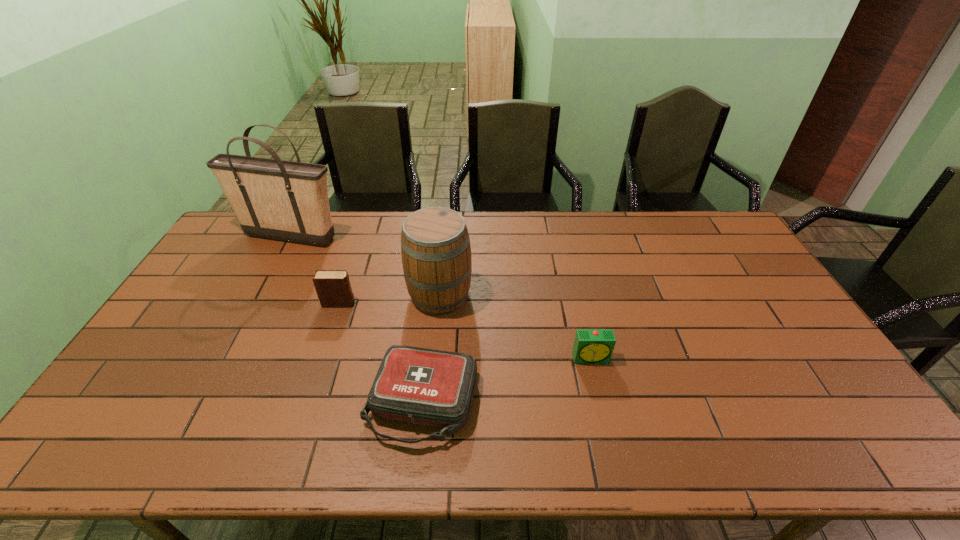
You are a GUI agent. You are given a task and a screenshot of the screen. Output one action in this format:
    pyautogui.click(x=<x>, y=<y>)
    Task: Click on the shopping bag
    Image resolution: width=960 pixels, height=540 pixels.
    Given the screenshot: What is the action you would take?
    pyautogui.click(x=275, y=199)

This screenshot has height=540, width=960. What are the coordinates of `the farthest object` in the screenshot? It's located at (275, 199).

Locate an element on the screen. This screenshot has height=540, width=960. the fourth shortest object is located at coordinates (435, 245).

Identify the location of the fourth object from right to left. (333, 288).

You are a GUI agent. You are given a task and a screenshot of the screen. Output one action in this format:
    pyautogui.click(x=<x>, y=<y>)
    Task: Click on the diary
    The height and width of the screenshot is (540, 960).
    Given the screenshot: What is the action you would take?
    pyautogui.click(x=333, y=288)

Image resolution: width=960 pixels, height=540 pixels. I want to click on the rightmost object, so click(x=591, y=346).

Locate an element on the screen. the first-aid kit is located at coordinates (416, 385).

Where is `blank area located 0.220m on the front of the shopping bag`? The image size is (960, 540). blank area located 0.220m on the front of the shopping bag is located at coordinates (261, 293).

Image resolution: width=960 pixels, height=540 pixels. In order to click on blank space located on the front of the cider in this screenshot , I will do `click(435, 348)`.

This screenshot has height=540, width=960. In order to click on free space located 0.060m on the spine side of the fourth object from right to left in this screenshot , I will do `click(374, 303)`.